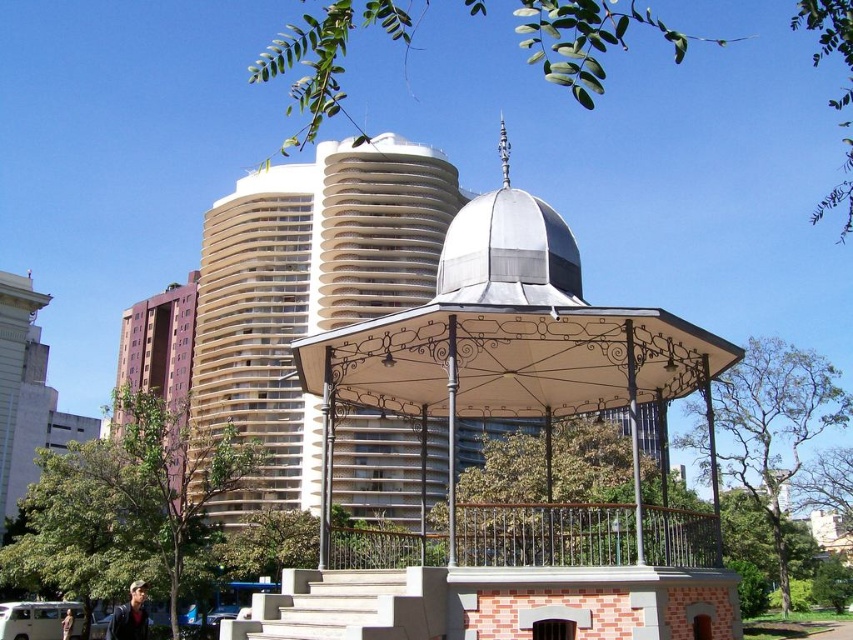
Question: Can you confirm if white wrought iron gazebo at center is smaller than beige concrete tower at center?

Choices:
 (A) no
 (B) yes

Answer: (B)

Question: Which point appears closest to the camera in this image?

Choices:
 (A) (222, 272)
 (B) (165, 385)

Answer: (A)

Question: Which object is positioned farthest from the white wrought iron gazebo at center?

Choices:
 (A) beige concrete tower at center
 (B) purple matte building at left

Answer: (B)

Question: Does beige concrete tower at center have a greater width compared to purple matte building at left?

Choices:
 (A) yes
 (B) no

Answer: (B)

Question: Is beige concrete tower at center wider than purple matte building at left?

Choices:
 (A) yes
 (B) no

Answer: (B)

Question: Which point appears closest to the camera in this image?

Choices:
 (A) (178, 387)
 (B) (263, 438)
 (C) (602, 340)

Answer: (C)